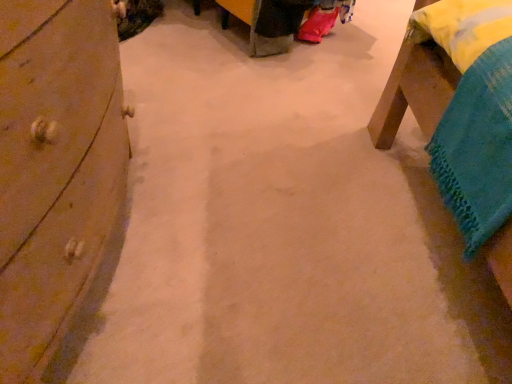
Question: Should I look upward or downward to see wooden dresser at left?

Choices:
 (A) down
 (B) up

Answer: (B)

Question: Can you confirm if wooden dresser at left is wider than wooden bed frame at upper right?

Choices:
 (A) no
 (B) yes

Answer: (B)

Question: Is wooden dresser at left surrounding wooden bed frame at upper right?

Choices:
 (A) yes
 (B) no

Answer: (B)

Question: From the image's perspective, is wooden dresser at left located beneath wooden bed frame at upper right?

Choices:
 (A) no
 (B) yes

Answer: (B)

Question: Can you confirm if wooden dresser at left is smaller than wooden bed frame at upper right?

Choices:
 (A) yes
 (B) no

Answer: (B)

Question: Is wooden dresser at left oriented away from wooden bed frame at upper right?

Choices:
 (A) no
 (B) yes

Answer: (A)

Question: Could you tell me if wooden dresser at left is facing wooden bed frame at upper right?

Choices:
 (A) yes
 (B) no

Answer: (A)

Question: Is wooden bed frame at upper right positioned far away from wooden dresser at left?

Choices:
 (A) yes
 (B) no

Answer: (B)

Question: From the image's perspective, is wooden bed frame at upper right located above wooden dresser at left?

Choices:
 (A) yes
 (B) no

Answer: (A)

Question: Is wooden bed frame at upper right behind wooden dresser at left?

Choices:
 (A) yes
 (B) no

Answer: (A)

Question: Is wooden bed frame at upper right at the left side of wooden dresser at left?

Choices:
 (A) yes
 (B) no

Answer: (B)

Question: Is wooden bed frame at upper right oriented away from wooden dresser at left?

Choices:
 (A) no
 (B) yes

Answer: (A)

Question: Is the position of wooden bed frame at upper right less distant than that of wooden dresser at left?

Choices:
 (A) yes
 (B) no

Answer: (B)

Question: Looking at their shapes, would you say wooden dresser at left is wider or thinner than wooden bed frame at upper right?

Choices:
 (A) wide
 (B) thin

Answer: (A)